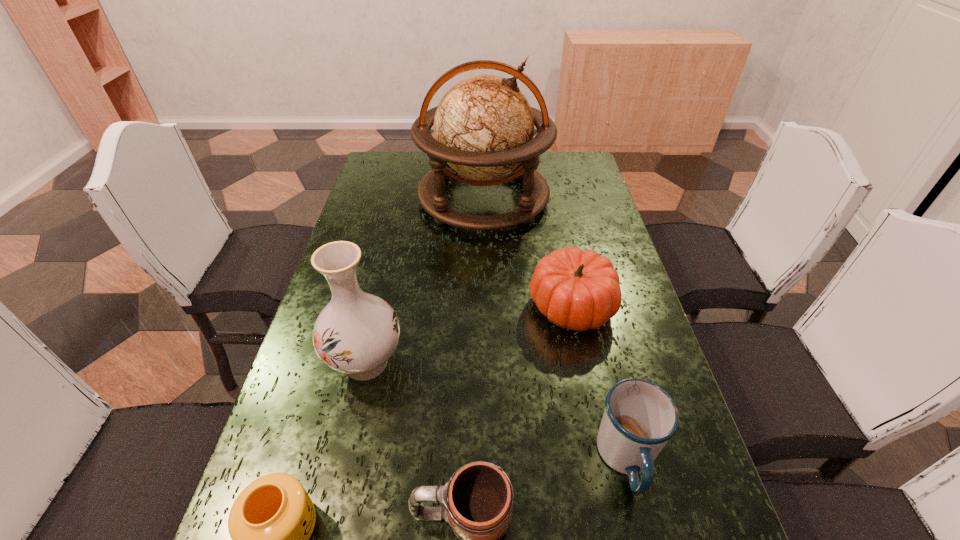
Find the location of a particular element. pumpkin that is at the right edge is located at coordinates (575, 289).

What are the coordinates of `mug that is at the right edge` in the screenshot? It's located at (639, 418).

Identify the location of free space at the right edge of the desktop. (563, 231).

Where is `free point at the far left corner`? free point at the far left corner is located at coordinates (375, 166).

At what (x,y) coordinates should I click in order to perform the action: click on free spot between the second tallest object and the rightmost mug. Please return your answer as a coordinate pair (x, y). This screenshot has height=540, width=960. Looking at the image, I should click on (496, 411).

The image size is (960, 540). What are the coordinates of `free spot between the pumpkin and the rightmost mug` in the screenshot? It's located at (599, 382).

The image size is (960, 540). Find the location of `free area in between the globe and the vase`. free area in between the globe and the vase is located at coordinates (424, 280).

Image resolution: width=960 pixels, height=540 pixels. I want to click on object identified as the closest to the second mug from right to left, so click(x=270, y=523).

Find the location of `object that ranks as the fourth closest to the tallest mug`. object that ranks as the fourth closest to the tallest mug is located at coordinates (270, 523).

Choose which mug is the second nearest neighbor to the leftmost mug. Please provide its 2D coordinates. Your answer should be formatted as a tuple, i.e. [(x, y)], where the tuple contains the x and y coordinates of a point satisfying the conditions above.

[(639, 418)]